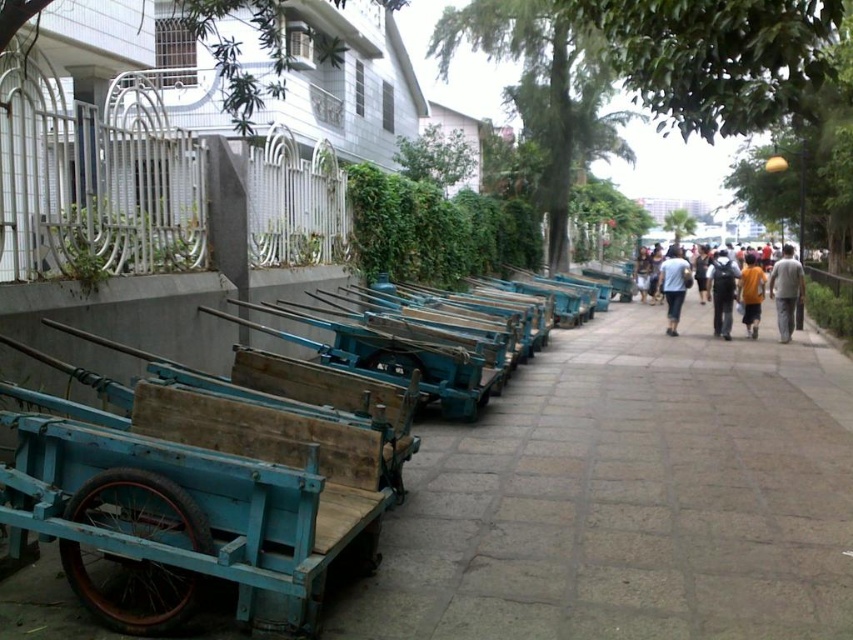
Is point (669, 310) less distant than point (763, 296)?

That is False.

Between light gray fabric shirt at center and yellow t-shirt at right, which one appears on the left side from the viewer's perspective?

yellow t-shirt at right is more to the left.

Between point (672, 308) and point (750, 262), which one is positioned behind?

The point (750, 262) is more distant.

This screenshot has width=853, height=640. What are the coordinates of `light gray fabric shirt at center` in the screenshot? It's located at (672, 285).

Which of these two, dark blue fabric jacket at center-right or yellow t-shirt at right, stands shorter?

yellow t-shirt at right is shorter.

Between dark blue fabric jacket at center-right and yellow t-shirt at right, which one appears on the left side from the viewer's perspective?

From the viewer's perspective, yellow t-shirt at right appears more on the left side.

The height and width of the screenshot is (640, 853). Describe the element at coordinates (722, 291) in the screenshot. I see `dark blue fabric jacket at center-right` at that location.

Locate an element on the screen. The image size is (853, 640). dark blue fabric jacket at center-right is located at coordinates (722, 291).

Is yellow cotton shirt at center positioned at the back of gray cotton pants at right?

Yes, it is.

From the picture: Can you confirm if yellow cotton shirt at center is bigger than gray cotton pants at right?

Incorrect, yellow cotton shirt at center is not larger than gray cotton pants at right.

Where is `yellow cotton shirt at center`? Image resolution: width=853 pixels, height=640 pixels. yellow cotton shirt at center is located at coordinates (753, 291).